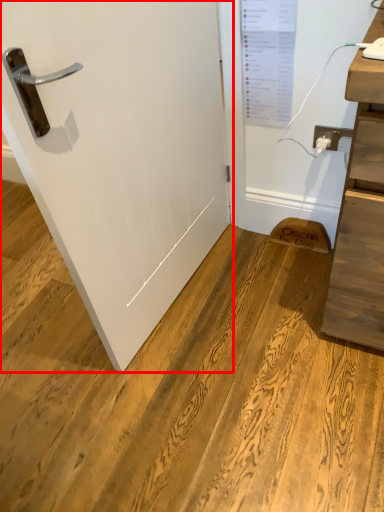
Question: From the image, what is the correct spatial relationship of door (annotated by the red box) in relation to electric outlet?

Choices:
 (A) left
 (B) right

Answer: (A)